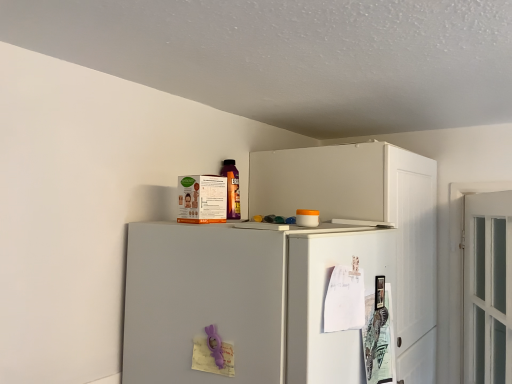
Question: Is white matte refrigerator at upper center next to white paper at upper right, placed as the 1th door when sorted from left to right, and touching it?

Choices:
 (A) yes
 (B) no

Answer: (B)

Question: Would you consider white matte refrigerator at upper center to be distant from white paper at upper right, placed as the 1th door when sorted from left to right?

Choices:
 (A) yes
 (B) no

Answer: (B)

Question: Could white paper at upper right, the 2th door viewed from the right, be considered to be inside white matte refrigerator at upper center?

Choices:
 (A) no
 (B) yes

Answer: (B)

Question: From a real-world perspective, is white matte refrigerator at upper center beneath white paper at upper right, placed as the 1th door when sorted from left to right?

Choices:
 (A) yes
 (B) no

Answer: (A)

Question: Can we say white matte refrigerator at upper center lies outside white paper at upper right, placed as the 1th door when sorted from left to right?

Choices:
 (A) no
 (B) yes

Answer: (B)

Question: Considering their positions, is white glass door at right, the first door viewed from the right, located in front of or behind white paper at upper right, placed as the 1th door when sorted from left to right?

Choices:
 (A) front
 (B) behind

Answer: (B)

Question: Do you think white glass door at right, which appears as the second door when viewed from the left, is within white paper at upper right, placed as the 1th door when sorted from left to right, or outside of it?

Choices:
 (A) inside
 (B) outside

Answer: (B)

Question: Is white glass door at right, which appears as the second door when viewed from the left, taller or shorter than white paper at upper right, placed as the 1th door when sorted from left to right?

Choices:
 (A) short
 (B) tall

Answer: (B)

Question: Considering the relative positions of white glass door at right, the first door viewed from the right, and white paper at upper right, the 2th door viewed from the right, in the image provided, is white glass door at right, the first door viewed from the right, to the left or to the right of white paper at upper right, the 2th door viewed from the right,?

Choices:
 (A) right
 (B) left

Answer: (A)

Question: From the image's perspective, is white paper at upper right, the 2th door viewed from the right, above or below white matte refrigerator at upper center?

Choices:
 (A) above
 (B) below

Answer: (A)

Question: From a real-world perspective, is white paper at upper right, placed as the 1th door when sorted from left to right, physically located above or below white matte refrigerator at upper center?

Choices:
 (A) above
 (B) below

Answer: (A)

Question: In terms of width, does white paper at upper right, the 2th door viewed from the right, look wider or thinner when compared to white matte refrigerator at upper center?

Choices:
 (A) wide
 (B) thin

Answer: (B)

Question: Considering the relative positions of white paper at upper right, the 2th door viewed from the right, and white matte refrigerator at upper center in the image provided, is white paper at upper right, the 2th door viewed from the right, to the left or to the right of white matte refrigerator at upper center?

Choices:
 (A) left
 (B) right

Answer: (B)

Question: Which is correct: white matte cabinet at upper right is inside white paper at upper right, placed as the 1th door when sorted from left to right, or outside of it?

Choices:
 (A) outside
 (B) inside

Answer: (A)

Question: Based on their positions, is white matte cabinet at upper right located to the left or right of white paper at upper right, placed as the 1th door when sorted from left to right?

Choices:
 (A) right
 (B) left

Answer: (A)